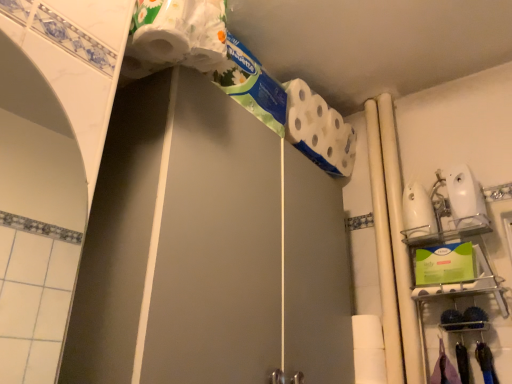
Question: From the image's perspective, relative to white matte toilet paper at upper center, is white glossy screen door at upper center above or below?

Choices:
 (A) above
 (B) below

Answer: (B)

Question: In terms of height, does white glossy screen door at upper center look taller or shorter compared to white matte toilet paper at upper center?

Choices:
 (A) tall
 (B) short

Answer: (A)

Question: Estimate the real-world distances between objects in this image. Which object is closer to the white matte pipe at center right, positioned as the 2th beam in right-to-left order?

Choices:
 (A) white glossy screen door at upper center
 (B) white matte toilet paper at upper center
 (C) white glossy beam at right, acting as the second beam starting from the left

Answer: (C)

Question: Which object is positioned farthest from the white glossy beam at right, which ranks as the first beam in right-to-left order?

Choices:
 (A) white glossy screen door at upper center
 (B) white matte toilet paper at upper center
 (C) white matte pipe at center right, positioned as the 2th beam in right-to-left order

Answer: (A)